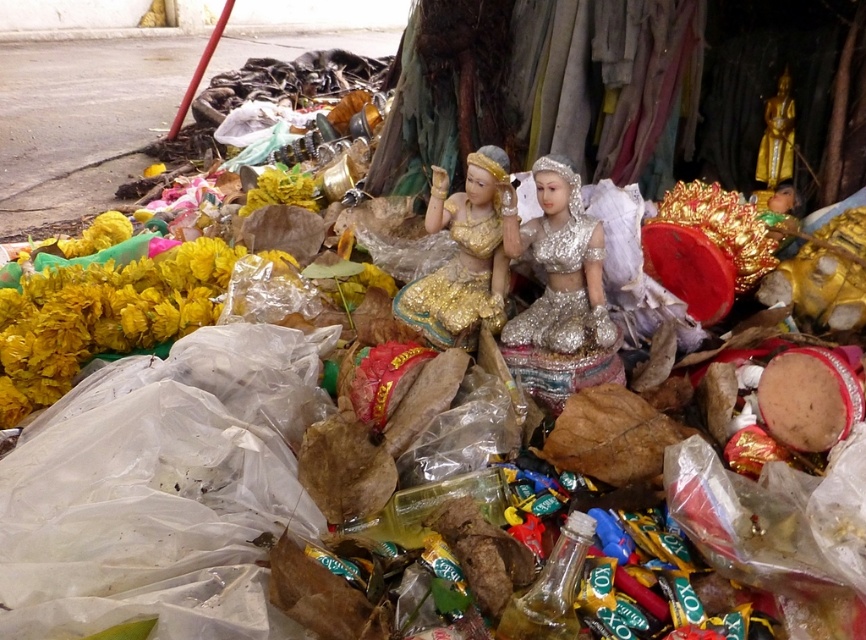
Which is more to the left, silver glittering doll at center or gold metallic statue at upper right?

silver glittering doll at center is more to the left.

Between silver glittering doll at center and gold metallic statue at upper right, which one appears on the right side from the viewer's perspective?

Result: Positioned to the right is gold metallic statue at upper right.

Measure the distance between silver glittering doll at center and camera.

silver glittering doll at center is 5.44 feet from camera.

Where is `silver glittering doll at center`? Image resolution: width=866 pixels, height=640 pixels. silver glittering doll at center is located at coordinates (558, 264).

Between point (430, 205) and point (302, 200), which one is positioned in front?

Point (430, 205) is more forward.

Does gold metallic doll at center have a larger size compared to yellow fabric flower at center-left?

Actually, gold metallic doll at center might be smaller than yellow fabric flower at center-left.

Who is more forward, [433,202] or [265,173]?

Positioned in front is point [433,202].

Find the location of a particular element. This screenshot has width=866, height=640. gold metallic doll at center is located at coordinates (464, 253).

Which is more to the left, yellow fabric flowers at left or gold metallic doll at center?

yellow fabric flowers at left is more to the left.

Which is in front, point (44, 321) or point (409, 316)?

Point (44, 321) is in front.

This screenshot has width=866, height=640. In order to click on yellow fabric flowers at left in this screenshot , I will do `click(102, 316)`.